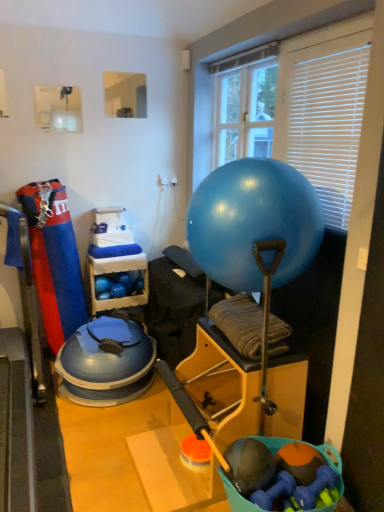
Question: Which direction should I rotate to look at transparent plastic window screen at upper center, arranged as the second window screen when viewed from the left, — up or down?

Choices:
 (A) up
 (B) down

Answer: (A)

Question: Is blue rubber balls at center shorter than white plastic blinds at upper right?

Choices:
 (A) no
 (B) yes

Answer: (B)

Question: Can you confirm if blue rubber balls at center is thinner than white plastic blinds at upper right?

Choices:
 (A) yes
 (B) no

Answer: (B)

Question: Is blue rubber balls at center facing towards white plastic blinds at upper right?

Choices:
 (A) no
 (B) yes

Answer: (A)

Question: Does blue rubber balls at center have a smaller size compared to white plastic blinds at upper right?

Choices:
 (A) no
 (B) yes

Answer: (A)

Question: Is the position of blue rubber balls at center less distant than that of white plastic blinds at upper right?

Choices:
 (A) yes
 (B) no

Answer: (B)

Question: Is blue rubber balls at center at the left side of white plastic blinds at upper right?

Choices:
 (A) no
 (B) yes

Answer: (B)

Question: From the image's perspective, does blue rubber ball at center appear lower than blue rubber balls at center?

Choices:
 (A) yes
 (B) no

Answer: (B)

Question: Can you confirm if blue rubber ball at center is thinner than blue rubber balls at center?

Choices:
 (A) yes
 (B) no

Answer: (B)

Question: Is blue rubber ball at center at the left side of blue rubber balls at center?

Choices:
 (A) no
 (B) yes

Answer: (A)

Question: From the image's perspective, is blue rubber ball at center on top of blue rubber balls at center?

Choices:
 (A) yes
 (B) no

Answer: (A)

Question: Is blue rubber ball at center further to camera compared to blue rubber balls at center?

Choices:
 (A) yes
 (B) no

Answer: (B)

Question: Considering the relative sizes of blue rubber ball at center and blue rubber balls at center in the image provided, is blue rubber ball at center shorter than blue rubber balls at center?

Choices:
 (A) yes
 (B) no

Answer: (B)

Question: From a real-world perspective, is blue rubber balls at center physically above blue rubber ball at center?

Choices:
 (A) no
 (B) yes

Answer: (A)